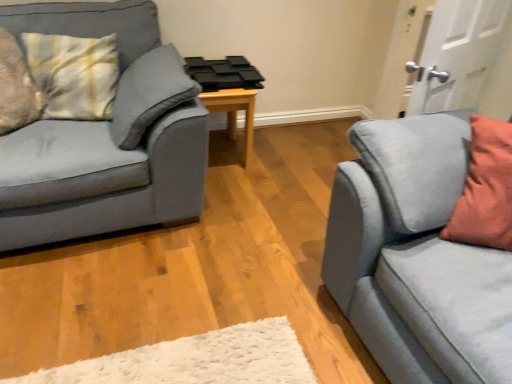
Question: From the image's perspective, is white matte door at upper right above or below wooden table at center?

Choices:
 (A) above
 (B) below

Answer: (A)

Question: Is white matte door at upper right wider or thinner than wooden table at center?

Choices:
 (A) thin
 (B) wide

Answer: (A)

Question: Which is farther from the white matte door at upper right?

Choices:
 (A) wooden table at center
 (B) matte blue couch at left, the first studio couch in the left-to-right sequence
 (C) suede blue studio couch at right, the first studio couch from the right

Answer: (B)

Question: Which object is the closest to the wooden table at center?

Choices:
 (A) suede blue studio couch at right, which ranks as the second studio couch in left-to-right order
 (B) matte blue couch at left, the first studio couch in the left-to-right sequence
 (C) white matte door at upper right

Answer: (B)